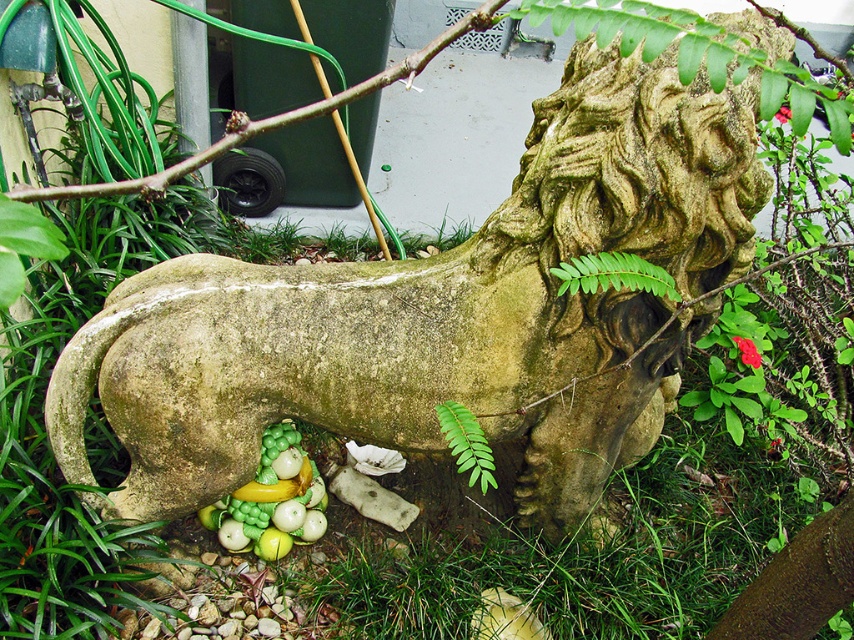
Between green stone lion at center and green matte fruit at lower center, which one appears on the right side from the viewer's perspective?

green stone lion at center is more to the right.

Is green stone lion at center above green matte fruit at lower center?

Yes.

Who is more distant from viewer, (642, 392) or (259, 486)?

Positioned behind is point (259, 486).

At what (x,y) coordinates should I click in order to perform the action: click on green stone lion at center. Please return your answer as a coordinate pair (x, y). Looking at the image, I should click on (442, 314).

Can you confirm if green matte fruit at lower center is shorter than green leafy fern at lower center?

No, green matte fruit at lower center is not shorter than green leafy fern at lower center.

Does green matte fruit at lower center have a smaller size compared to green leafy fern at lower center?

No, green matte fruit at lower center is not smaller than green leafy fern at lower center.

Who is more distant from viewer, (205, 515) or (480, 442)?

The point (205, 515) is more distant.

Find the location of a particular element. green matte fruit at lower center is located at coordinates click(x=272, y=499).

How far apart are green matte flower at lower right and red matte flower at upper right?

green matte flower at lower right is 62.01 centimeters away from red matte flower at upper right.

Who is more forward, (741, 339) or (788, 109)?

Point (741, 339) is more forward.

Between point (740, 356) and point (782, 115), which one is positioned behind?

The point (782, 115) is more distant.

Locate an element on the screen. The width and height of the screenshot is (854, 640). green matte flower at lower right is located at coordinates (747, 352).